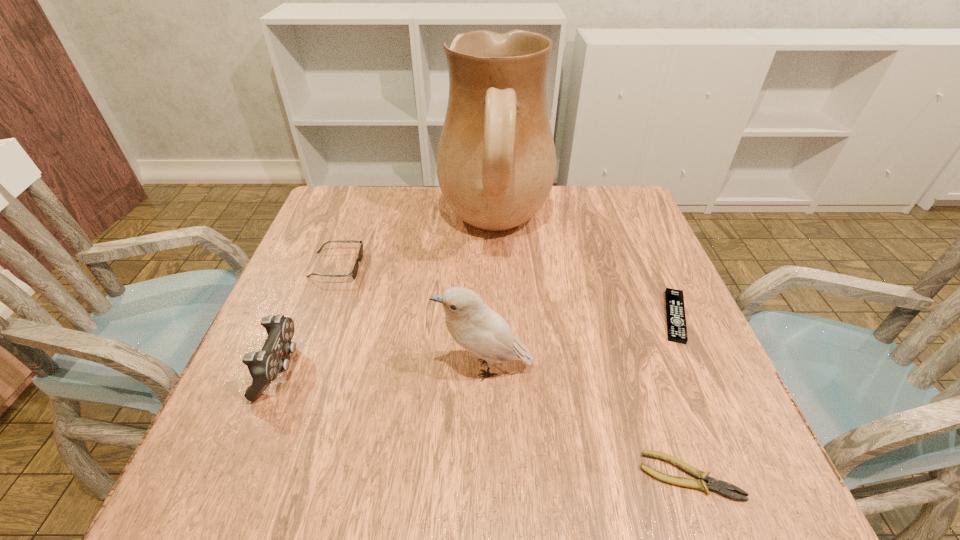
This screenshot has width=960, height=540. I want to click on cream pitcher, so click(x=496, y=162).

This screenshot has height=540, width=960. What are the coordinates of `the fifth shortest object` in the screenshot? It's located at [x=473, y=325].

You are a GUI agent. You are given a task and a screenshot of the screen. Output one action in this format:
    pyautogui.click(x=<x>, y=<y>)
    Task: Click on the fourth shortest object
    This screenshot has width=960, height=540.
    Given the screenshot: What is the action you would take?
    pyautogui.click(x=264, y=366)

I want to click on the fourth tallest object, so click(x=360, y=254).

Locate an element on the screen. remote control is located at coordinates (675, 310).

You are a GUI agent. You are given a task and a screenshot of the screen. Output one action in this format:
    pyautogui.click(x=<x>, y=<y>)
    Task: Click on the nearest object
    Image resolution: width=960 pixels, height=540 pixels.
    Given the screenshot: What is the action you would take?
    pyautogui.click(x=712, y=484)

I want to click on vacant area situated at the spout of the cream pitcher, so click(345, 227).

I want to click on free space located at the spout of the cream pitcher, so click(318, 227).

Locate an element on the screen. This screenshot has width=960, height=540. free space located at the spout of the cream pitcher is located at coordinates (351, 227).

Identify the location of free region located 0.110m at the beak of the second tallest object. (377, 368).